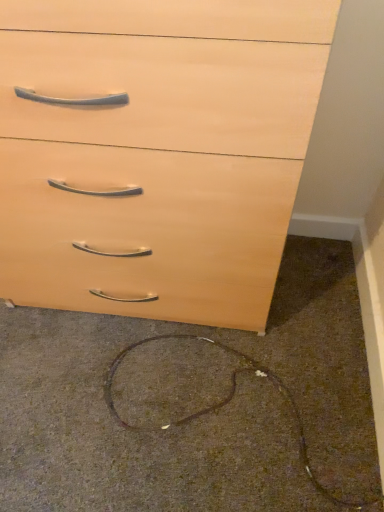
Question: Considering the relative sizes of brown matte wire at lower center and light wood/finish chest of drawers at upper center in the image provided, is brown matte wire at lower center smaller than light wood/finish chest of drawers at upper center?

Choices:
 (A) yes
 (B) no

Answer: (A)

Question: From a real-world perspective, is brown matte wire at lower center beneath light wood/finish chest of drawers at upper center?

Choices:
 (A) yes
 (B) no

Answer: (A)

Question: Is brown matte wire at lower center in front of light wood/finish chest of drawers at upper center?

Choices:
 (A) no
 (B) yes

Answer: (A)

Question: From the image's perspective, is brown matte wire at lower center above light wood/finish chest of drawers at upper center?

Choices:
 (A) yes
 (B) no

Answer: (B)

Question: Is brown matte wire at lower center aimed at light wood/finish chest of drawers at upper center?

Choices:
 (A) yes
 (B) no

Answer: (B)

Question: Is brown matte wire at lower center in contact with light wood/finish chest of drawers at upper center?

Choices:
 (A) yes
 (B) no

Answer: (B)

Question: Is light wood/finish chest of drawers at upper center to the right of brown matte wire at lower center from the viewer's perspective?

Choices:
 (A) no
 (B) yes

Answer: (A)

Question: Is light wood/finish chest of drawers at upper center oriented away from brown matte wire at lower center?

Choices:
 (A) no
 (B) yes

Answer: (A)

Question: Is light wood/finish chest of drawers at upper center thinner than brown matte wire at lower center?

Choices:
 (A) yes
 (B) no

Answer: (A)

Question: From the image's perspective, is light wood/finish chest of drawers at upper center under brown matte wire at lower center?

Choices:
 (A) no
 (B) yes

Answer: (A)

Question: Is brown matte wire at lower center completely or partially inside light wood/finish chest of drawers at upper center?

Choices:
 (A) no
 (B) yes

Answer: (A)

Question: Can you confirm if light wood/finish chest of drawers at upper center is wider than brown matte wire at lower center?

Choices:
 (A) yes
 (B) no

Answer: (B)

Question: From the image's perspective, relative to brown matte wire at lower center, is light wood/finish chest of drawers at upper center above or below?

Choices:
 (A) above
 (B) below

Answer: (A)